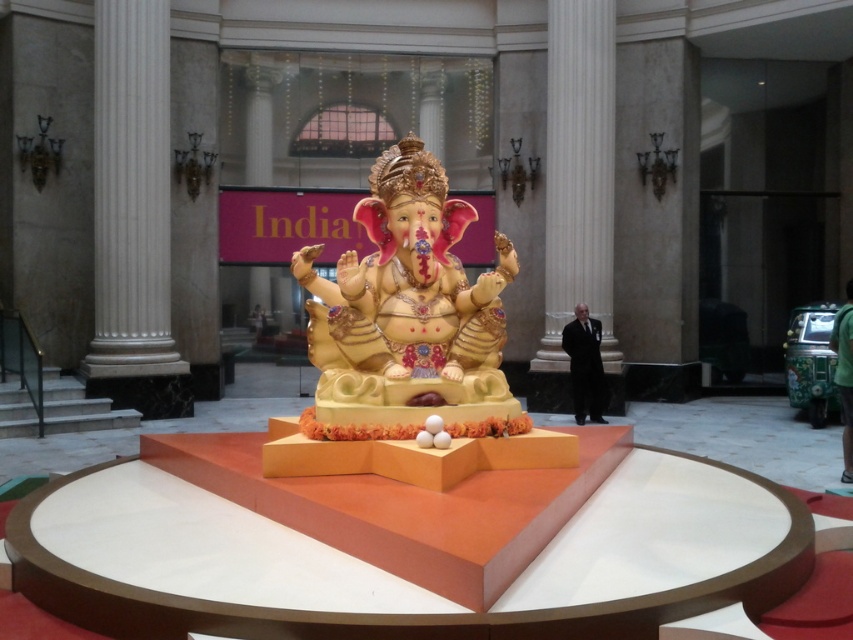
Is the position of gold/golden statue at center more distant than that of white marble pillar at center?

No.

Does point (451, 365) come in front of point (549, 307)?

That is True.

I want to click on gold/golden statue at center, so click(x=408, y=307).

At what (x,y) coordinates should I click in order to perform the action: click on gold/golden statue at center. Please return your answer as a coordinate pair (x, y). This screenshot has height=640, width=853. Looking at the image, I should click on (408, 307).

Which is above, white marble column at left or white marble pillar at center?

white marble pillar at center

Who is more forward, (x=138, y=224) or (x=552, y=157)?

Point (x=138, y=224)

Who is more forward, (111, 68) or (553, 292)?

Point (111, 68)

Locate an element on the screen. Image resolution: width=853 pixels, height=640 pixels. white marble column at left is located at coordinates (131, 193).

Can you confirm if gold/golden statue at center is wider than white marble column at left?

Yes, gold/golden statue at center is wider than white marble column at left.

Who is more distant from viewer, (480, 387) or (120, 28)?

The point (120, 28) is behind.

This screenshot has height=640, width=853. Find the location of `gold/golden statue at center`. gold/golden statue at center is located at coordinates (408, 307).